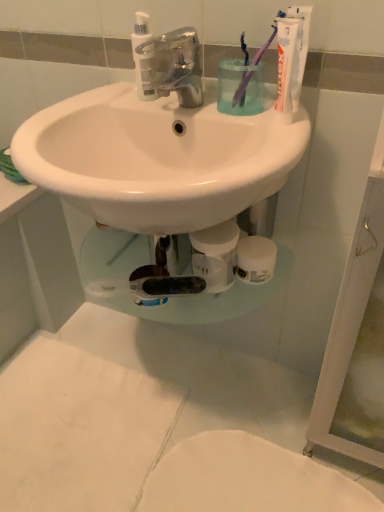
Describe the element at coordinates (139, 56) in the screenshot. I see `translucent plastic pump bottle at upper center` at that location.

What are the coordinates of `white matte toilet at lower center` in the screenshot? It's located at (247, 479).

In order to click on translucent plastic cup at upper center in this screenshot , I will do `click(238, 86)`.

The image size is (384, 512). Describe the element at coordinates (242, 89) in the screenshot. I see `purple plastic toothbrush at upper center, arranged as the second toothbrush when viewed from the right` at that location.

The height and width of the screenshot is (512, 384). I want to click on purple plastic toothbrush at upper center, arranged as the second toothbrush when viewed from the right, so click(x=242, y=89).

You are a GUI agent. You are given a task and a screenshot of the screen. Output one action in this format:
    pyautogui.click(x=<x>, y=<y>)
    Task: Click on the translucent plastic pump bottle at upper center
    This screenshot has width=384, height=512.
    Given the screenshot: What is the action you would take?
    pyautogui.click(x=139, y=56)

Is white matte tube at upper right wider than translucent plastic cup at upper center?

Incorrect, the width of white matte tube at upper right does not surpass that of translucent plastic cup at upper center.

Would you say white matte tube at upper right is outside translucent plastic cup at upper center?

Indeed, white matte tube at upper right is completely outside translucent plastic cup at upper center.

From a real-world perspective, which is physically below, white matte tube at upper right or translucent plastic cup at upper center?

translucent plastic cup at upper center, from a real-world perspective.

From the picture: How distant is chrome metallic faucet at center from translucent plastic cup at upper center?

chrome metallic faucet at center is 10.80 centimeters from translucent plastic cup at upper center.

From a real-world perspective, is chrome metallic faucet at center above or below translucent plastic cup at upper center?

From a real-world perspective, chrome metallic faucet at center is physically above translucent plastic cup at upper center.

Which is behind, point (180, 38) or point (221, 112)?

The point (221, 112) is farther from the camera.

Is chrome metallic faucet at center with translucent plastic cup at upper center?

chrome metallic faucet at center and translucent plastic cup at upper center are clearly separated.

I want to click on toothbrush that is the 1st one when counting leftward from the white matte toilet at lower center, so click(241, 88).

From the image's perspective, which is above, white matte toilet at lower center or purple plastic toothbrush at upper right, the 2th toothbrush positioned from the left?

purple plastic toothbrush at upper right, the 2th toothbrush positioned from the left, appears higher in the image.

From a real-world perspective, is white matte toilet at lower center positioned under purple plastic toothbrush at upper right, which is counted as the 1th toothbrush, starting from the right, based on gravity?

Yes, from a real-world perspective, white matte toilet at lower center is under purple plastic toothbrush at upper right, which is counted as the 1th toothbrush, starting from the right.

From the image's perspective, would you say translucent plastic pump bottle at upper center is shown under translucent plastic cup at upper center?

Actually, translucent plastic pump bottle at upper center appears above translucent plastic cup at upper center in the image.

In the image, is translucent plastic pump bottle at upper center positioned in front of or behind translucent plastic cup at upper center?

Visually, translucent plastic pump bottle at upper center is located behind translucent plastic cup at upper center.

Is translucent plastic pump bottle at upper center touching translucent plastic cup at upper center?

There is a gap between translucent plastic pump bottle at upper center and translucent plastic cup at upper center.

Measure the distance from translucent plastic pump bottle at upper center to translucent plastic cup at upper center.

translucent plastic pump bottle at upper center and translucent plastic cup at upper center are 7.08 inches apart from each other.

Can you see purple plastic toothbrush at upper center, arranged as the second toothbrush when viewed from the right, touching white matte toilet at lower center?

They are not placed beside each other.

Where is `toilet on the right of purple plastic toothbrush at upper center, arranged as the second toothbrush when viewed from the right`? This screenshot has width=384, height=512. toilet on the right of purple plastic toothbrush at upper center, arranged as the second toothbrush when viewed from the right is located at coordinates (247, 479).

Between purple plastic toothbrush at upper center, arranged as the second toothbrush when viewed from the right, and white matte toilet at lower center, which one has larger width?

Wider between the two is white matte toilet at lower center.

Between purple plastic toothbrush at upper center, which ranks as the first toothbrush in left-to-right order, and white matte toilet at lower center, which one appears on the left side from the viewer's perspective?

purple plastic toothbrush at upper center, which ranks as the first toothbrush in left-to-right order.

Are white matte tube at upper right and purple plastic toothbrush at upper center, arranged as the second toothbrush when viewed from the right, located far from each other?

white matte tube at upper right is near purple plastic toothbrush at upper center, arranged as the second toothbrush when viewed from the right, not far away.

Considering the sizes of objects white matte tube at upper right and purple plastic toothbrush at upper center, arranged as the second toothbrush when viewed from the right, in the image provided, who is wider, white matte tube at upper right or purple plastic toothbrush at upper center, arranged as the second toothbrush when viewed from the right,?

purple plastic toothbrush at upper center, arranged as the second toothbrush when viewed from the right.

In terms of height, does white matte tube at upper right look taller or shorter compared to purple plastic toothbrush at upper center, which ranks as the first toothbrush in left-to-right order?

Clearly, white matte tube at upper right is taller compared to purple plastic toothbrush at upper center, which ranks as the first toothbrush in left-to-right order.

Which of these two, white matte toilet at lower center or translucent plastic pump bottle at upper center, stands taller?

Standing taller between the two is translucent plastic pump bottle at upper center.

Does point (219, 492) appear closer or farther from the camera than point (145, 62)?

Point (219, 492) is farther from the camera than point (145, 62).

In terms of width, does white matte toilet at lower center look wider or thinner when compared to translucent plastic pump bottle at upper center?

white matte toilet at lower center is wider than translucent plastic pump bottle at upper center.

From the image's perspective, between white matte toilet at lower center and translucent plastic pump bottle at upper center, who is located below?

white matte toilet at lower center, from the image's perspective.

At what (x,y) coordinates should I click in order to perform the action: click on toothpaste positioned vertically above the translucent plastic cup at upper center (from a real-world perspective). Please return your answer as a coordinate pair (x, y). Looking at the image, I should click on pos(299,51).

Identify the location of tap above the translucent plastic cup at upper center (from the image's perspective). (172, 66).

Looking at the image, which one is located closer to white matte tube at upper right, translucent plastic pump bottle at upper center or translucent plastic cup at upper center?

Based on the image, translucent plastic cup at upper center appears to be nearer to white matte tube at upper right.

When comparing their distances from white matte toilet at lower center, does purple plastic toothbrush at upper center, which ranks as the first toothbrush in left-to-right order, or purple plastic toothbrush at upper right, the 2th toothbrush positioned from the left, seem closer?

purple plastic toothbrush at upper right, the 2th toothbrush positioned from the left, lies closer to white matte toilet at lower center than the other object.

Which object lies nearer to the anchor point white matte tube at upper right, translucent plastic pump bottle at upper center or white matte toilet at lower center?

The object closer to white matte tube at upper right is translucent plastic pump bottle at upper center.

Looking at the image, which one is located further to translucent plastic cup at upper center, white matte tube at upper right or purple plastic toothbrush at upper center, which ranks as the first toothbrush in left-to-right order?

Among the two, white matte tube at upper right is located further to translucent plastic cup at upper center.

Which object lies further to the anchor point white matte toilet at lower center, translucent plastic cup at upper center or purple plastic toothbrush at upper center, which ranks as the first toothbrush in left-to-right order?

purple plastic toothbrush at upper center, which ranks as the first toothbrush in left-to-right order, is positioned further to the anchor white matte toilet at lower center.

Estimate the real-world distances between objects in this image. Which object is closer to translucent plastic cup at upper center, purple plastic toothbrush at upper center, arranged as the second toothbrush when viewed from the right, or white matte tube at upper right?

purple plastic toothbrush at upper center, arranged as the second toothbrush when viewed from the right.

Which object lies nearer to the anchor point translucent plastic cup at upper center, purple plastic toothbrush at upper right, which is counted as the 1th toothbrush, starting from the right, or chrome metallic faucet at center?

purple plastic toothbrush at upper right, which is counted as the 1th toothbrush, starting from the right, is closer to translucent plastic cup at upper center.

Based on their spatial positions, is chrome metallic faucet at center or white matte tube at upper right closer to translucent plastic pump bottle at upper center?

chrome metallic faucet at center lies closer to translucent plastic pump bottle at upper center than the other object.

Locate an element on the screen. tap between translucent plastic pump bottle at upper center and purple plastic toothbrush at upper right, the 2th toothbrush positioned from the left, in the horizontal direction is located at coordinates (172, 66).

I want to click on toothpaste between purple plastic toothbrush at upper center, arranged as the second toothbrush when viewed from the right, and white matte toilet at lower center vertically, so click(x=299, y=51).

I want to click on tap between translucent plastic pump bottle at upper center and purple plastic toothbrush at upper center, which ranks as the first toothbrush in left-to-right order, in the horizontal direction, so click(172, 66).

Locate an element on the screen. This screenshot has width=384, height=512. liquid between purple plastic toothbrush at upper right, the 2th toothbrush positioned from the left, and white matte toilet at lower center from top to bottom is located at coordinates (238, 86).